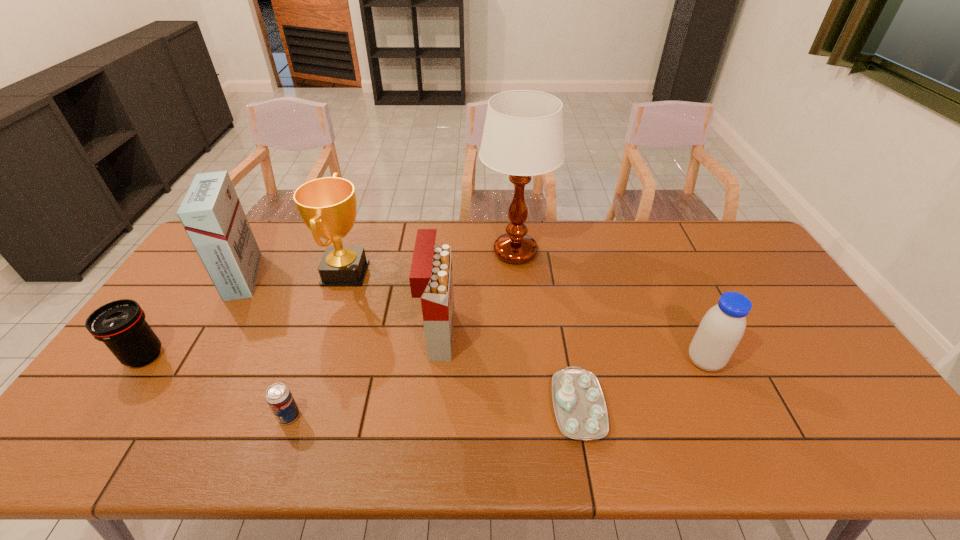
The width and height of the screenshot is (960, 540). I want to click on beer can, so click(278, 396).

The height and width of the screenshot is (540, 960). Find the location of `chinaware`. chinaware is located at coordinates (579, 404).

Locate an element on the screen. blank area located on the left of the tallest object is located at coordinates click(x=390, y=252).

The width and height of the screenshot is (960, 540). Identify the location of free region located on the right of the farther cigarette case. (337, 276).

Where is `vacant region located on the front-facing side of the award`? This screenshot has height=540, width=960. vacant region located on the front-facing side of the award is located at coordinates (401, 273).

Image resolution: width=960 pixels, height=540 pixels. Find the location of `free space located 0.280m with the lid open on the fifth object from left to right`. free space located 0.280m with the lid open on the fifth object from left to right is located at coordinates (551, 335).

I want to click on vacant area situated 0.090m on the front of the soya milk, so click(x=726, y=407).

Find the location of a particular element. The height and width of the screenshot is (540, 960). vacant space positioned 0.140m on the right of the telephoto lens is located at coordinates (217, 356).

The image size is (960, 540). In order to click on vacant space located 0.110m on the right of the seventh tallest object in this screenshot , I will do `click(346, 416)`.

This screenshot has width=960, height=540. What are the coordinates of `free location located on the back of the shortest object` in the screenshot? It's located at (556, 289).